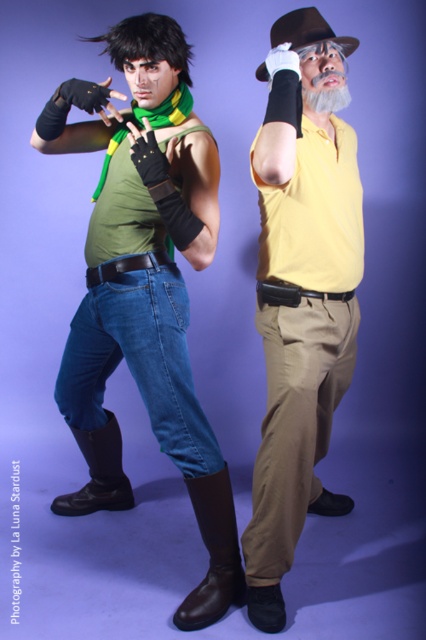
You are a costume designer trying to fit a new accessory between the matte green tank top at left and the matte yellow shirt at center. Based on their widths, which one should you place the accessory closer to to ensure it fits better?

The matte green tank top at left is wider than the matte yellow shirt at center, so placing the accessory closer to the matte yellow shirt at center would leave more space on the wider side of the matte green tank top at left for better fit.

You are an artist trying to sketch the scene. You need to place the matte green tank top at left in your drawing. What are the coordinates where you should position it?

The matte green tank top at left should be positioned at coordinates 0.453 in the x axis and 0.343 in the y axis.